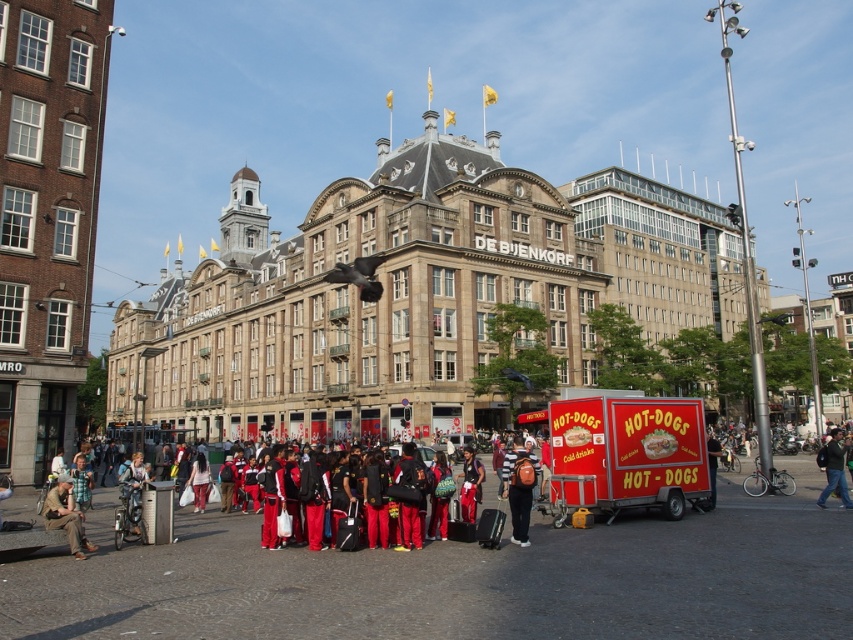
You are a delivery driver who needs to park your truck at the red painted trailer at lower right. The parking space is 4 meters long. Is the truck, which is 4 meters long, able to fit into the space?

The parking space is 4 meters long, and the truck is also 4 meters long, so the truck can fit into the space.

You are a delivery person who needs to move a package from the red painted trailer at lower right to the matte black backpack at center. Given that your cart can only carry items within a 10 meter radius, can you complete the delivery without needing assistance?

The red painted trailer at lower right is 11.29 meters from the matte black backpack at center. Since the distance exceeds the 10 meter radius capacity of your cart, you will need assistance to complete the delivery.